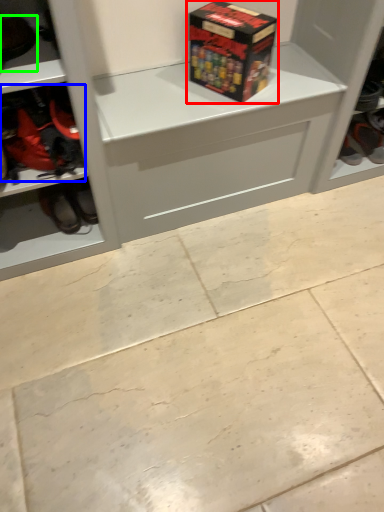
Question: Estimate the real-world distances between objects in this image. Which object is farther from box (highlighted by a red box), footwear (highlighted by a blue box) or footwear (highlighted by a green box)?

Choices:
 (A) footwear
 (B) footwear

Answer: (B)